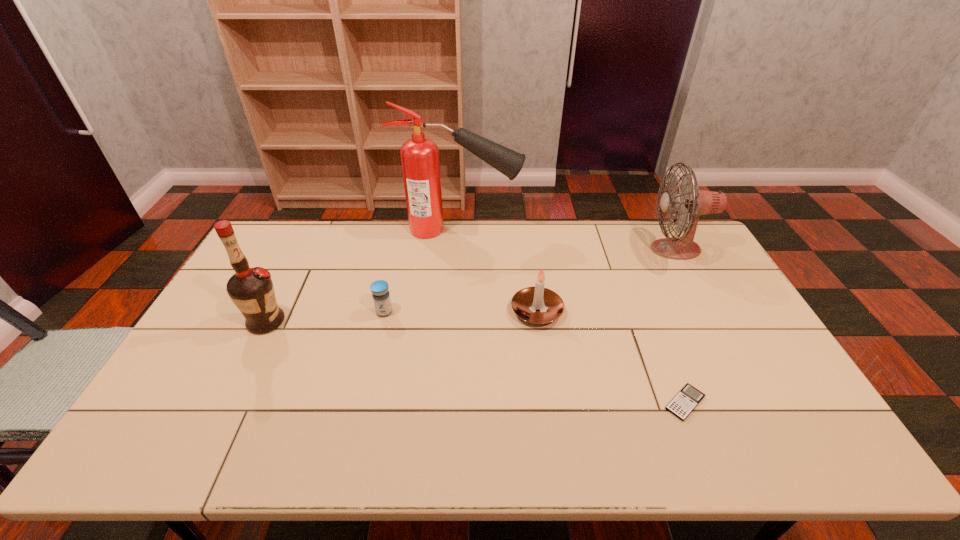
The image size is (960, 540). Identify the location of free space between the shortest object and the third shortest object. (611, 357).

The height and width of the screenshot is (540, 960). I want to click on unoccupied position between the fifth tallest object and the second object from right to left, so pos(535,357).

Identify the location of free space between the candle and the fifth tallest object. (461, 312).

The height and width of the screenshot is (540, 960). What are the coordinates of `free space between the medicine and the tallest object` in the screenshot? It's located at (421, 271).

The width and height of the screenshot is (960, 540). I want to click on free space between the candle and the rightmost object, so click(606, 280).

The width and height of the screenshot is (960, 540). Identify the location of unoccupied area between the shortest object and the liquor. (475, 362).

This screenshot has height=540, width=960. Find the location of `the fourth closest object relative to the calculator`. the fourth closest object relative to the calculator is located at coordinates (381, 297).

Locate which object is the second closest to the candle. Please provide its 2D coordinates. Your answer should be formatted as a tuple, i.e. [(x, y)], where the tuple contains the x and y coordinates of a point satisfying the conditions above.

[(420, 162)]

You are a GUI agent. You are given a task and a screenshot of the screen. Output one action in this format:
    pyautogui.click(x=<x>, y=<y>)
    Task: Click on the free location that satisfies the following two spatial constraints: 1. in front of the fan to direct airflow; 2. on the front side of the medicine
    The image size is (960, 540).
    Given the screenshot: What is the action you would take?
    pyautogui.click(x=709, y=312)

Find the location of a particular element. The image size is (960, 540). vacant space that satisfies the following two spatial constraints: 1. at the nozzle of the candle; 2. on the left side of the fire extinguisher is located at coordinates (454, 311).